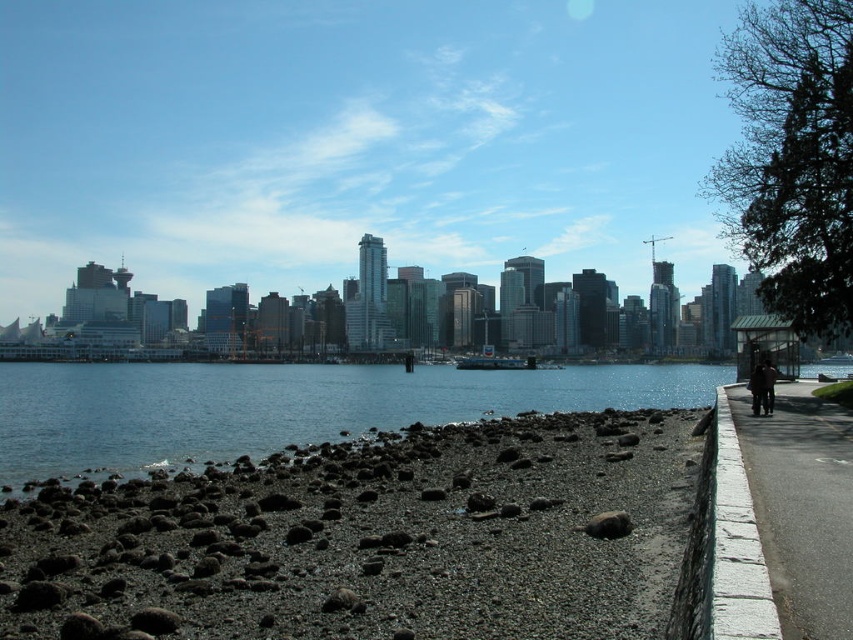
Is dark gray gravel at lower left further to camera compared to clear blue water at lower left?

No, dark gray gravel at lower left is in front of clear blue water at lower left.

Who is higher up, dark gray gravel at lower left or clear blue water at lower left?

dark gray gravel at lower left is above.

Locate an element on the screen. The width and height of the screenshot is (853, 640). dark gray gravel at lower left is located at coordinates (370, 538).

Where is `dark gray gravel at lower left`? The width and height of the screenshot is (853, 640). dark gray gravel at lower left is located at coordinates (370, 538).

Between dark gray gravel at lower left and asphalt pavement at right, which one appears on the left side from the viewer's perspective?

Result: dark gray gravel at lower left

Does point (422, 435) come farther from viewer compared to point (741, 413)?

Yes, point (422, 435) is behind point (741, 413).

Image resolution: width=853 pixels, height=640 pixels. Find the location of `dark gray gravel at lower left`. dark gray gravel at lower left is located at coordinates (370, 538).

Who is higher up, clear blue water at lower left or asphalt pavement at right?

Positioned higher is asphalt pavement at right.

Is clear blue water at lower left shorter than asphalt pavement at right?

No, clear blue water at lower left is not shorter than asphalt pavement at right.

Is point (213, 384) positioned in front of point (770, 502)?

No.

You are a GUI agent. You are given a task and a screenshot of the screen. Output one action in this format:
    pyautogui.click(x=<x>, y=<y>)
    Task: Click on the clear blue water at lower left
    This screenshot has height=640, width=853.
    Given the screenshot: What is the action you would take?
    pyautogui.click(x=283, y=406)